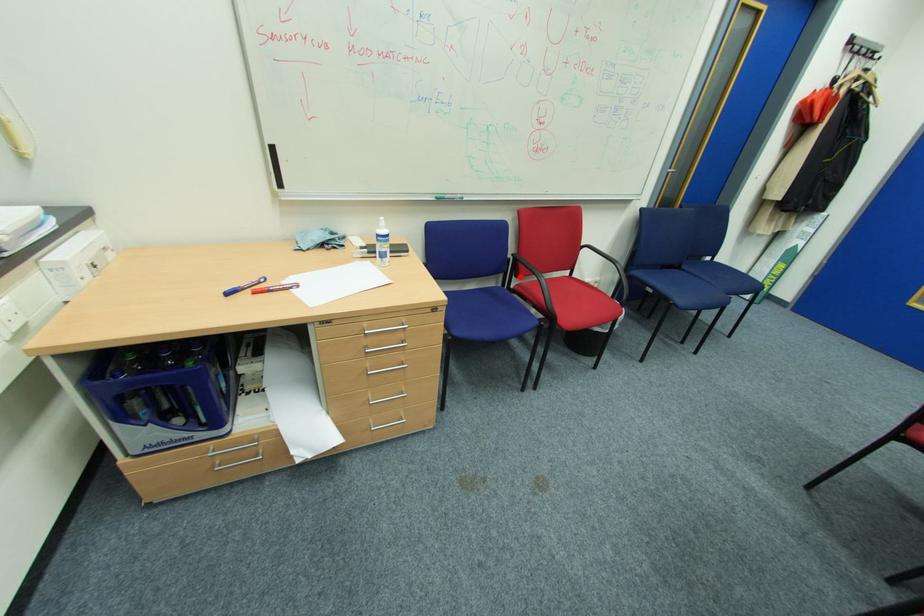
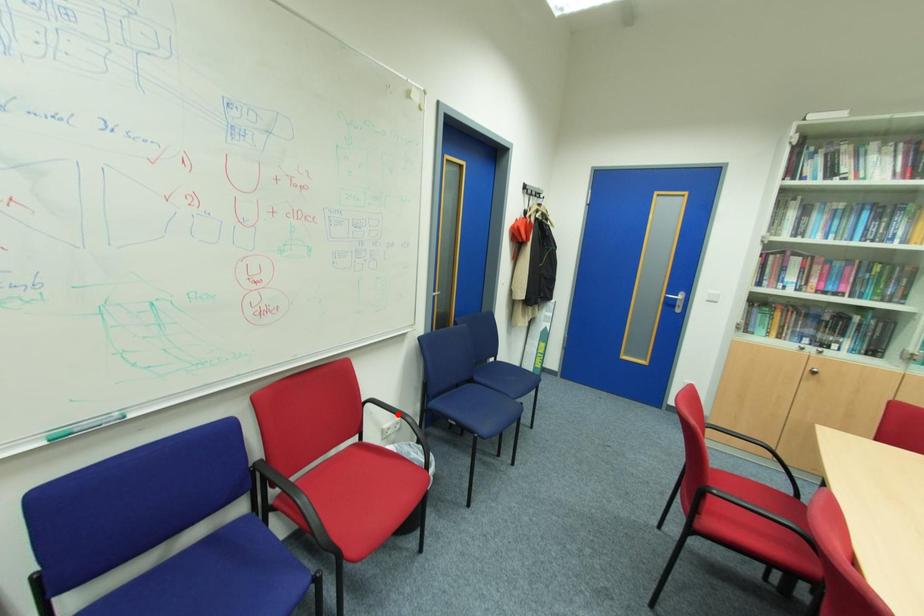
I am providing you with two images of the same scene from different viewpoints. A red point is marked on the first image and another point is marked on the second image. Do the highlighted points in image1 and image2 indicate the same real-world spot?

No